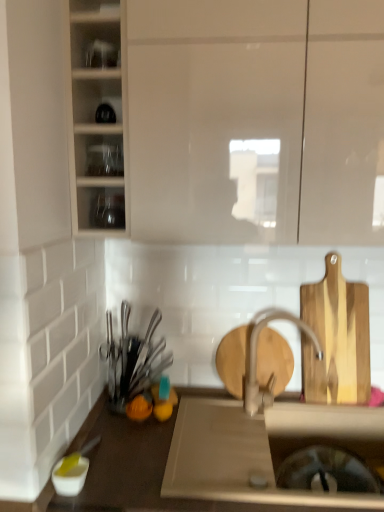
Find the location of `free spot behind white glossy bowl at lower left, which is the 2th tableware in right-to-left order`. free spot behind white glossy bowl at lower left, which is the 2th tableware in right-to-left order is located at coordinates (113, 442).